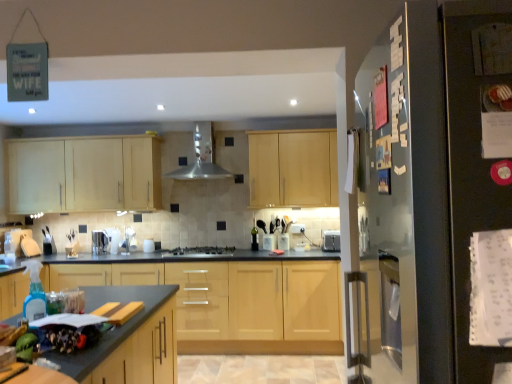
Question: From the image's perspective, does granite gray countertop at lower left appear lower than light wood cabinet at center, which is the 1th cabinetry from bottom to top?

Choices:
 (A) no
 (B) yes

Answer: (A)

Question: Is granite gray countertop at lower left positioned beyond the bounds of light wood cabinet at center, which is the 1th cabinetry from bottom to top?

Choices:
 (A) yes
 (B) no

Answer: (A)

Question: Is the position of granite gray countertop at lower left less distant than that of light wood cabinet at center, marked as the 3th cabinetry in a top-to-bottom arrangement?

Choices:
 (A) no
 (B) yes

Answer: (B)

Question: Is light wood cabinet at center, which is the 1th cabinetry from bottom to top, inside granite gray countertop at lower left?

Choices:
 (A) yes
 (B) no

Answer: (B)

Question: Is light wood cabinet at center, marked as the 3th cabinetry in a top-to-bottom arrangement, at the back of granite gray countertop at lower left?

Choices:
 (A) no
 (B) yes

Answer: (A)

Question: Considering the positions of light wood cabinet at center, marked as the third cabinetry in a bottom-to-top arrangement, and satin silver gas stove at center in the image, is light wood cabinet at center, marked as the third cabinetry in a bottom-to-top arrangement, bigger or smaller than satin silver gas stove at center?

Choices:
 (A) small
 (B) big

Answer: (B)

Question: Considering the positions of light wood cabinet at center, which is the first cabinetry in top-to-bottom order, and satin silver gas stove at center in the image, is light wood cabinet at center, which is the first cabinetry in top-to-bottom order, wider or thinner than satin silver gas stove at center?

Choices:
 (A) thin
 (B) wide

Answer: (A)

Question: From their relative heights in the image, would you say light wood cabinet at center, marked as the third cabinetry in a bottom-to-top arrangement, is taller or shorter than satin silver gas stove at center?

Choices:
 (A) short
 (B) tall

Answer: (B)

Question: Does point (268, 180) appear closer or farther from the camera than point (192, 253)?

Choices:
 (A) farther
 (B) closer

Answer: (A)

Question: Does point (233, 246) appear closer or farther from the camera than point (338, 238)?

Choices:
 (A) closer
 (B) farther

Answer: (B)

Question: Is satin silver gas stove at center to the left or to the right of satin silver toaster at center, the 2th appliance in the left-to-right sequence, in the image?

Choices:
 (A) left
 (B) right

Answer: (A)

Question: Is satin silver gas stove at center bigger or smaller than satin silver toaster at center, the 2th appliance in the left-to-right sequence?

Choices:
 (A) small
 (B) big

Answer: (B)

Question: From the image's perspective, is satin silver gas stove at center above or below satin silver toaster at center, the 2th appliance in the left-to-right sequence?

Choices:
 (A) below
 (B) above

Answer: (A)

Question: Considering the positions of light wood cabinet at upper left, positioned as the second cabinetry in bottom-to-top order, and light wood cabinet at center, which is the first cabinetry in top-to-bottom order, in the image, is light wood cabinet at upper left, positioned as the second cabinetry in bottom-to-top order, taller or shorter than light wood cabinet at center, which is the first cabinetry in top-to-bottom order,?

Choices:
 (A) short
 (B) tall

Answer: (A)

Question: Looking at their shapes, would you say light wood cabinet at upper left, which appears as the second cabinetry when viewed from the top, is wider or thinner than light wood cabinet at center, marked as the third cabinetry in a bottom-to-top arrangement?

Choices:
 (A) thin
 (B) wide

Answer: (A)